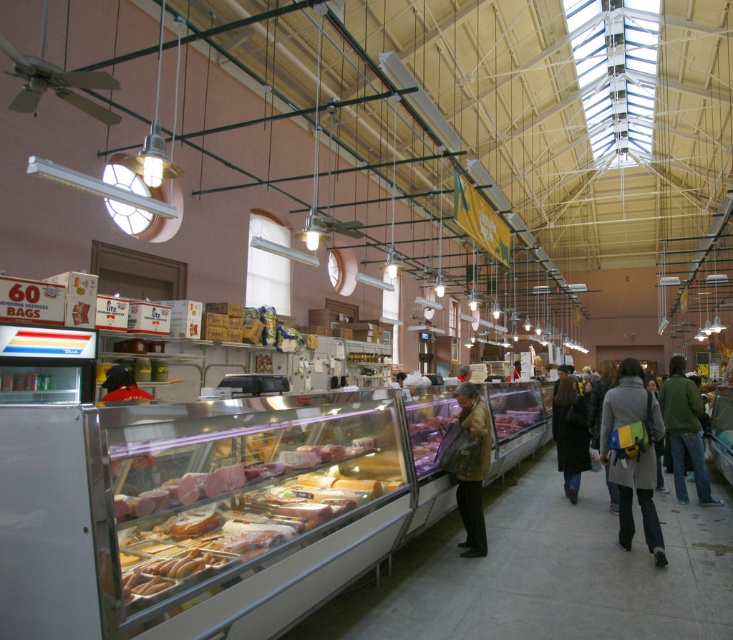
Question: Among these points, which one is nearest to the camera?

Choices:
 (A) (460, 380)
 (B) (600, 362)
 (C) (655, 522)

Answer: (C)

Question: Can you confirm if brown leather jacket at center is positioned to the right of dark brown leather jacket at center?

Choices:
 (A) yes
 (B) no

Answer: (B)

Question: Can you confirm if smooth pink meat at center is positioned below brown leather jacket at center?

Choices:
 (A) no
 (B) yes

Answer: (B)

Question: Estimate the real-world distances between objects in this image. Which object is farther from the brown textured coat at center?

Choices:
 (A) translucent plastic meat at center
 (B) gray fabric coat at center
 (C) brown leather jacket at center

Answer: (C)

Question: Based on their relative distances, which object is nearer to the dark gray jacket at center?

Choices:
 (A) brown leather jacket at center
 (B) gray fabric coat at center

Answer: (B)

Question: Does green wool coat at center have a lesser width compared to brown textured coat at center?

Choices:
 (A) no
 (B) yes

Answer: (A)